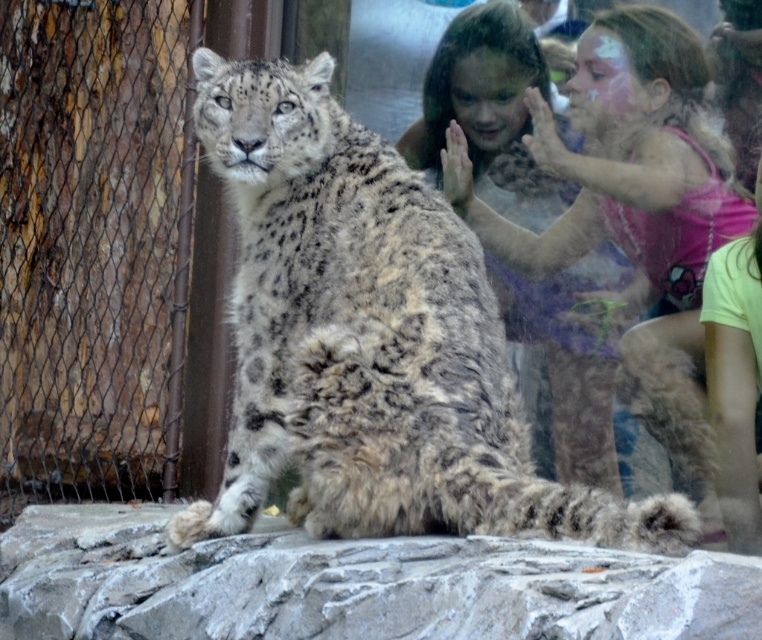
Question: Which object appears closest to the camera in this image?

Choices:
 (A) spotted fur cheetah at center
 (B) gray rough stone at center
 (C) smooth skin child at upper right

Answer: (B)

Question: Is the position of gray rough stone at center more distant than that of smooth skin child at upper right?

Choices:
 (A) yes
 (B) no

Answer: (B)

Question: Which is farther from the smooth skin child at upper right?

Choices:
 (A) spotted fur cheetah at center
 (B) gray rough stone at center

Answer: (B)

Question: Which point is closer to the camera?

Choices:
 (A) smooth skin child at upper right
 (B) spotted fur cheetah at center
 (C) gray rough stone at center

Answer: (C)

Question: Is gray rough stone at center smaller than smooth skin child at upper right?

Choices:
 (A) no
 (B) yes

Answer: (A)

Question: Can you confirm if gray rough stone at center is bigger than smooth skin child at upper right?

Choices:
 (A) yes
 (B) no

Answer: (A)